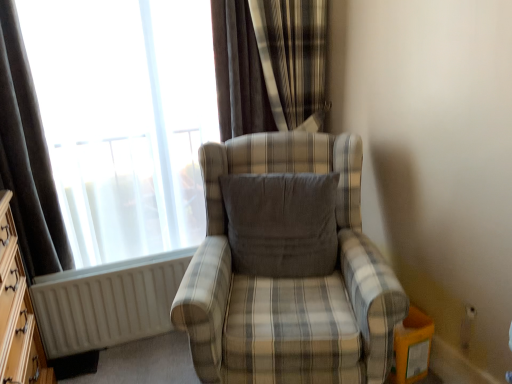
Question: From a real-world perspective, is gray fabric pillow at center above or below white matte radiator at lower left?

Choices:
 (A) above
 (B) below

Answer: (A)

Question: Looking at their shapes, would you say gray fabric pillow at center is wider or thinner than white matte radiator at lower left?

Choices:
 (A) wide
 (B) thin

Answer: (A)

Question: Estimate the real-world distances between objects in this image. Which object is closer to the white matte radiator at lower left?

Choices:
 (A) dark fabric curtain at left, acting as the 1th curtain starting from the left
 (B) wooden dresser at left
 (C) velvet-like brown curtain at upper center, which ranks as the second curtain in left-to-right order
 (D) plaid fabric chair at center
 (E) matte glass window at upper left

Answer: (B)

Question: Considering the real-world distances, which object is closest to the plaid fabric chair at center?

Choices:
 (A) matte glass window at upper left
 (B) wooden dresser at left
 (C) dark fabric curtain at left, acting as the 1th curtain starting from the left
 (D) white matte radiator at lower left
 (E) gray fabric pillow at center

Answer: (E)